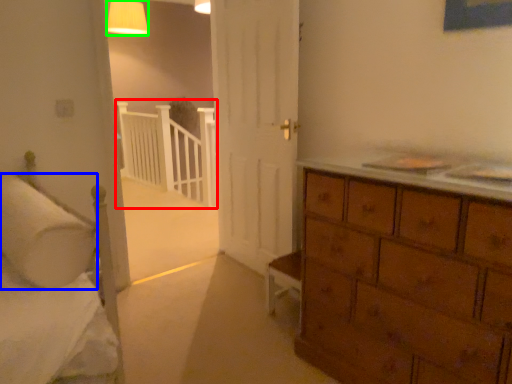
Question: Based on their relative distances, which object is nearer to balustrade (highlighted by a red box)? Choose from pillow (highlighted by a blue box) and lighting (highlighted by a green box).

Choices:
 (A) pillow
 (B) lighting

Answer: (B)